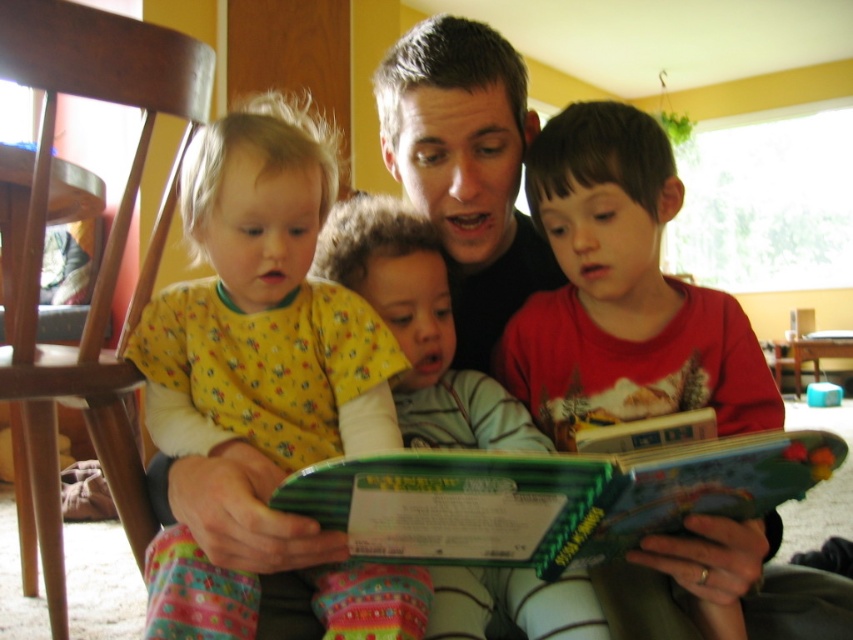
You are a parent trying to decide which item to place on a narrow shelf that can only hold items up to 10 cm in height. The hardcover book at center and the fluffy white blanket at center are both candidates. Which item should you choose?

The hardcover book at center has a lesser height compared to the fluffy white blanket at center, so you should choose the hardcover book at center since it is shorter and will fit on the narrow shelf.

You are a photographer setting up a shot of the scene. You need to position a light to the left of both the floral print pajamas at left and the wooden chair at left. Is this possible?

The floral print pajamas at left is to the right of wooden chair at left, so positioning a light to the left of both would require placing it to the left of the wooden chair at left, which is the furthest left object. This is possible as there is space to the left of the wooden chair at left.